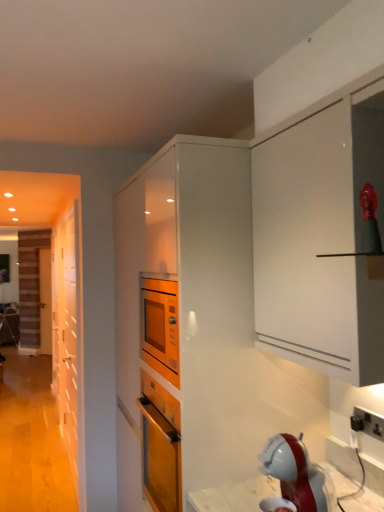
In order to face wooden door at left, the first door when ordered from right to left, should I rotate leftwards or rightwards?

Turn left approximately 16.115 degrees to face it.

Where is `black plastic electrical outlet at lower right`? This screenshot has height=512, width=384. black plastic electrical outlet at lower right is located at coordinates (367, 423).

I want to click on wooden door at left, which is the 2th door from back to front, so [x=67, y=332].

Is white glossy cabinet at center oriented towards wooden at left, placed as the 2th door when sorted from front to back?

No, white glossy cabinet at center is not oriented towards wooden at left, placed as the 2th door when sorted from front to back.

From a real-world perspective, who is located higher, white glossy cabinet at center or wooden at left, placed as the 1th door when sorted from back to front?

white glossy cabinet at center is physically above.

Image resolution: width=384 pixels, height=512 pixels. I want to click on cabinetry on the right of wooden at left, the first door when ordered from left to right, so click(189, 313).

Considering the positions of objects white glossy cabinet at center and wooden at left, the first door when ordered from left to right, in the image provided, who is behind, white glossy cabinet at center or wooden at left, the first door when ordered from left to right,?

wooden at left, the first door when ordered from left to right.

Does wooden at left, placed as the 1th door when sorted from back to front, touch black plastic electrical outlet at lower right?

No, wooden at left, placed as the 1th door when sorted from back to front, is not next to black plastic electrical outlet at lower right.

Is wooden at left, marked as the 2th door in a right-to-left arrangement, looking in the opposite direction of black plastic electrical outlet at lower right?

wooden at left, marked as the 2th door in a right-to-left arrangement, is not turned away from black plastic electrical outlet at lower right.

Does wooden at left, placed as the 1th door when sorted from back to front, have a larger size compared to black plastic electrical outlet at lower right?

Correct, wooden at left, placed as the 1th door when sorted from back to front, is larger in size than black plastic electrical outlet at lower right.

Which is more to the left, wooden at left, placed as the 2th door when sorted from front to back, or black plastic electrical outlet at lower right?

Positioned to the left is wooden at left, placed as the 2th door when sorted from front to back.

From a real-world perspective, is wooden at left, placed as the 2th door when sorted from front to back, below wooden door at left, the 1th door positioned from the front?

No, from a real-world perspective, wooden at left, placed as the 2th door when sorted from front to back, is not under wooden door at left, the 1th door positioned from the front.

From the image's perspective, which is above, wooden at left, marked as the 2th door in a right-to-left arrangement, or wooden door at left, the 1th door positioned from the front?

wooden door at left, the 1th door positioned from the front, appears higher in the image.

Can we say wooden at left, placed as the 2th door when sorted from front to back, lies outside wooden door at left, marked as the second door in a left-to-right arrangement?

Absolutely, wooden at left, placed as the 2th door when sorted from front to back, is external to wooden door at left, marked as the second door in a left-to-right arrangement.

Considering the relative sizes of wooden at left, placed as the 1th door when sorted from back to front, and wooden door at left, marked as the second door in a left-to-right arrangement, in the image provided, is wooden at left, placed as the 1th door when sorted from back to front, taller than wooden door at left, marked as the second door in a left-to-right arrangement,?

No.

Considering the relative sizes of black plastic electrical outlet at lower right and white glossy cabinet at center in the image provided, is black plastic electrical outlet at lower right smaller than white glossy cabinet at center?

Yes.

How many degrees apart are the facing directions of black plastic electrical outlet at lower right and white glossy cabinet at center?

The angular difference between black plastic electrical outlet at lower right and white glossy cabinet at center is 14.4 degrees.

From the image's perspective, is black plastic electrical outlet at lower right on top of white glossy cabinet at center?

Indeed, from the image's perspective, black plastic electrical outlet at lower right is shown above white glossy cabinet at center.

Are black plastic electrical outlet at lower right and white glossy cabinet at center making contact?

black plastic electrical outlet at lower right and white glossy cabinet at center are not in contact.

Is wooden door at left, the 1th door positioned from the front, turned away from white glossy cabinet at center?

That's not correct — wooden door at left, the 1th door positioned from the front, is not looking away from white glossy cabinet at center.

Which is correct: wooden door at left, the first door when ordered from right to left, is inside white glossy cabinet at center, or outside of it?

wooden door at left, the first door when ordered from right to left, exists outside the volume of white glossy cabinet at center.

Considering the relative positions of wooden door at left, which is the 2th door from back to front, and white glossy cabinet at center in the image provided, is wooden door at left, which is the 2th door from back to front, to the right of white glossy cabinet at center from the viewer's perspective?

Incorrect, wooden door at left, which is the 2th door from back to front, is not on the right side of white glossy cabinet at center.

I want to click on electric outlet in front of the wooden door at left, marked as the second door in a left-to-right arrangement, so click(x=367, y=423).

From the image's perspective, is wooden door at left, marked as the second door in a left-to-right arrangement, over black plastic electrical outlet at lower right?

Actually, wooden door at left, marked as the second door in a left-to-right arrangement, appears below black plastic electrical outlet at lower right in the image.

Can you confirm if wooden door at left, marked as the second door in a left-to-right arrangement, is wider than black plastic electrical outlet at lower right?

Indeed, wooden door at left, marked as the second door in a left-to-right arrangement, has a greater width compared to black plastic electrical outlet at lower right.

From the image's perspective, is white glossy cabinet at center under wooden door at left, the 1th door positioned from the front?

Actually, white glossy cabinet at center appears above wooden door at left, the 1th door positioned from the front, in the image.

Who is smaller, white glossy cabinet at center or wooden door at left, the first door when ordered from right to left?

wooden door at left, the first door when ordered from right to left.

Looking at this image, considering the relative sizes of white glossy cabinet at center and wooden door at left, the first door when ordered from right to left, in the image provided, is white glossy cabinet at center thinner than wooden door at left, the first door when ordered from right to left,?

Incorrect, the width of white glossy cabinet at center is not less than that of wooden door at left, the first door when ordered from right to left.

How distant is white glossy cabinet at center from wooden door at left, which is the 2th door from back to front?

A distance of 2.41 meters exists between white glossy cabinet at center and wooden door at left, which is the 2th door from back to front.

You are a GUI agent. You are given a task and a screenshot of the screen. Output one action in this format:
    pyautogui.click(x=<x>, y=<y>)
    Task: Click on the 2nd door behind the white glossy cabinet at center
    The height and width of the screenshot is (512, 384).
    Given the screenshot: What is the action you would take?
    pyautogui.click(x=45, y=301)

Which door is the 2nd one when counting from the left side of the black plastic electrical outlet at lower right? Please provide its 2D coordinates.

[(45, 301)]

When comparing their distances from wooden door at left, marked as the second door in a left-to-right arrangement, does white glossy cabinet at center or black plastic electrical outlet at lower right seem closer?

Based on the image, white glossy cabinet at center appears to be nearer to wooden door at left, marked as the second door in a left-to-right arrangement.

Estimate the real-world distances between objects in this image. Which object is closer to wooden at left, the first door when ordered from left to right, black plastic electrical outlet at lower right or white glossy cabinet at center?

white glossy cabinet at center is positioned closer to the anchor wooden at left, the first door when ordered from left to right.

Based on the photo, estimate the real-world distances between objects in this image. Which object is further from black plastic electrical outlet at lower right, white glossy cabinet at center or wooden door at left, the first door when ordered from right to left?

wooden door at left, the first door when ordered from right to left, is positioned further to the anchor black plastic electrical outlet at lower right.

Based on their spatial positions, is wooden at left, placed as the 1th door when sorted from back to front, or white glossy cabinet at center further from black plastic electrical outlet at lower right?

wooden at left, placed as the 1th door when sorted from back to front, is positioned further to the anchor black plastic electrical outlet at lower right.

When comparing their distances from wooden door at left, the 1th door positioned from the front, does black plastic electrical outlet at lower right or white glossy cabinet at center seem further?

The object further to wooden door at left, the 1th door positioned from the front, is black plastic electrical outlet at lower right.

Looking at the image, which one is located closer to white glossy cabinet at center, wooden at left, placed as the 1th door when sorted from back to front, or black plastic electrical outlet at lower right?

black plastic electrical outlet at lower right lies closer to white glossy cabinet at center than the other object.

Based on the photo, which object lies further to the anchor point wooden at left, placed as the 2th door when sorted from front to back, white glossy cabinet at center or wooden door at left, the first door when ordered from right to left?

white glossy cabinet at center.

Which object lies nearer to the anchor point white glossy cabinet at center, wooden at left, placed as the 1th door when sorted from back to front, or wooden door at left, which is the 2th door from back to front?

wooden door at left, which is the 2th door from back to front, lies closer to white glossy cabinet at center than the other object.

Where is `door between black plastic electrical outlet at lower right and wooden at left, placed as the 2th door when sorted from front to back, along the z-axis`? door between black plastic electrical outlet at lower right and wooden at left, placed as the 2th door when sorted from front to back, along the z-axis is located at coordinates (67, 332).

At what (x,y) coordinates should I click in order to perform the action: click on cabinetry located between wooden door at left, marked as the second door in a left-to-right arrangement, and black plastic electrical outlet at lower right in the left-right direction. Please return your answer as a coordinate pair (x, y). This screenshot has height=512, width=384. Looking at the image, I should click on (189, 313).

I want to click on cabinetry between black plastic electrical outlet at lower right and wooden at left, the first door when ordered from left to right, from front to back, so click(x=189, y=313).

The image size is (384, 512). Identify the location of door located between white glossy cabinet at center and wooden at left, the first door when ordered from left to right, in the depth direction. (67, 332).